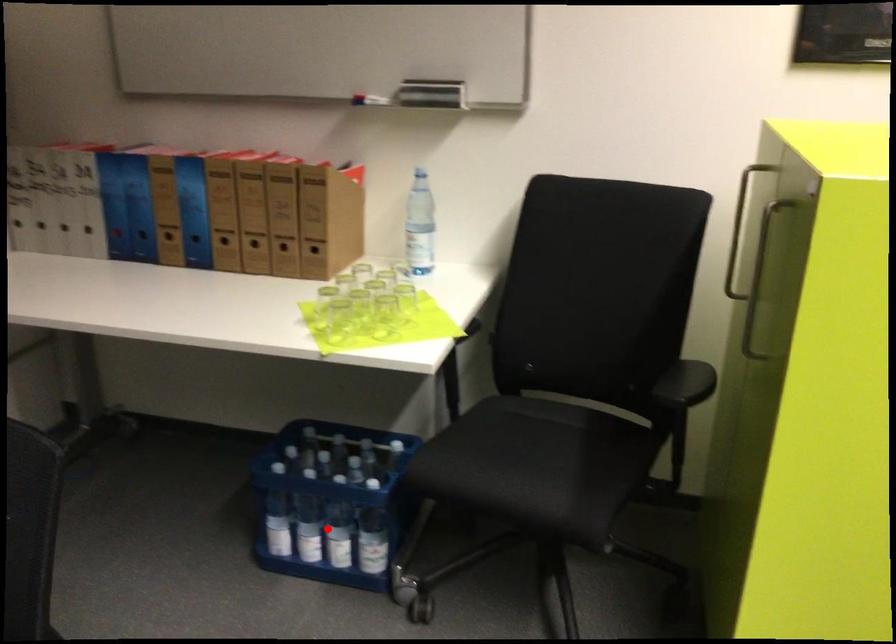
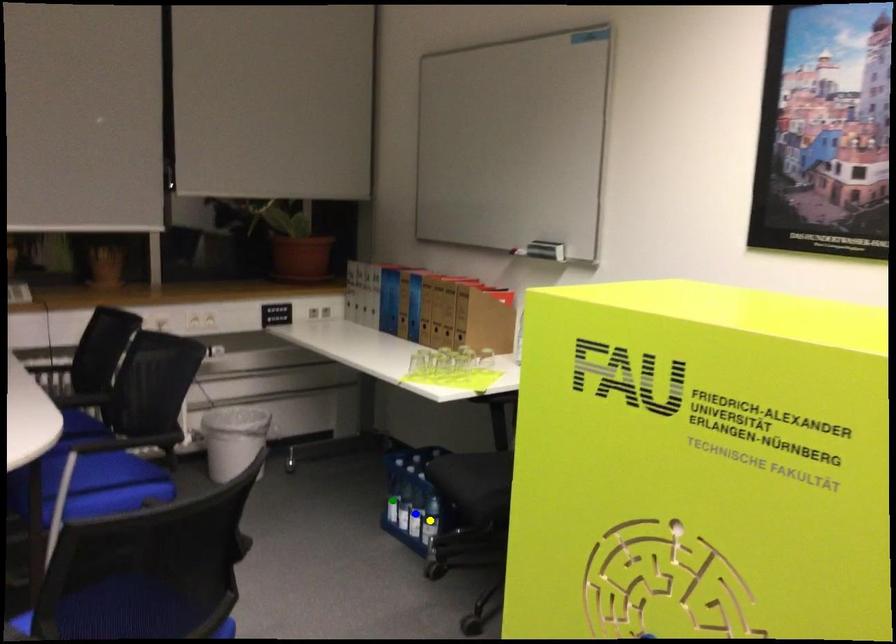
Question: I am providing you with two images of the same scene from different viewpoints. A red point is marked on the first image. You are given multiple points on the second image. Which spot in image 2 lines up with the point in image 1?

Choices:
 (A) green point
 (B) yellow point
 (C) blue point

Answer: (C)